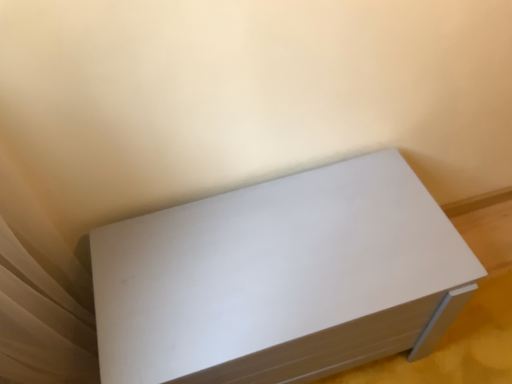
The image size is (512, 384). Describe the element at coordinates (277, 278) in the screenshot. I see `white matte table at center` at that location.

Measure the distance between point (426, 224) and camera.

Point (426, 224) is 38.31 inches from camera.

This screenshot has height=384, width=512. Find the location of `white matte table at center`. white matte table at center is located at coordinates pyautogui.click(x=277, y=278).

Locate an element on the screen. The width and height of the screenshot is (512, 384). white matte table at center is located at coordinates (277, 278).